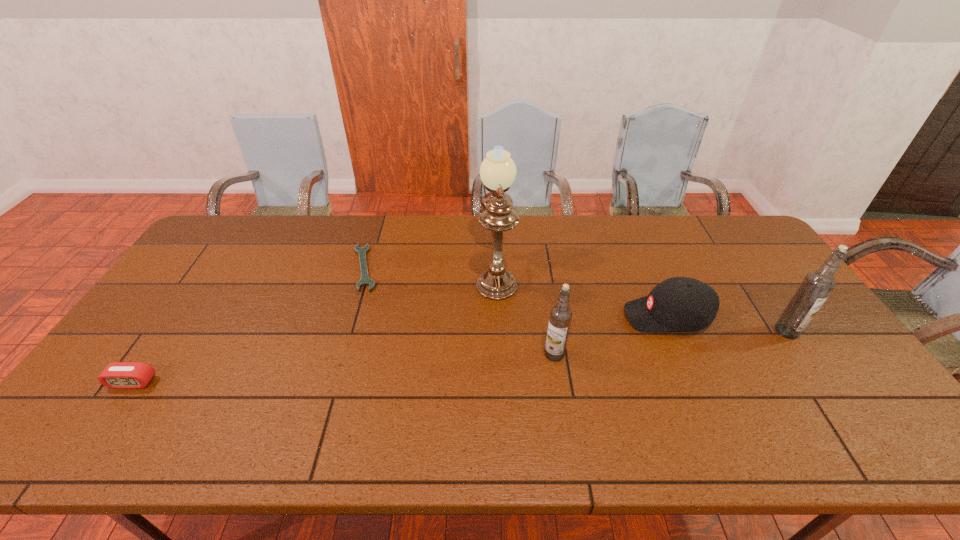
Where is `free region located on the back of the shortest object`? This screenshot has width=960, height=540. free region located on the back of the shortest object is located at coordinates (377, 225).

In order to click on free space located on the front-facing side of the leftmost object in this screenshot , I will do `click(115, 407)`.

Where is `oil lamp at the far edge`? oil lamp at the far edge is located at coordinates (497, 171).

I want to click on wrench that is at the far edge, so click(x=365, y=280).

Locate an element on the screen. Image resolution: width=960 pixels, height=540 pixels. object at the near edge is located at coordinates (118, 375).

You are a GUI agent. You are given a task and a screenshot of the screen. Output one action in this format:
    pyautogui.click(x=<x>, y=<y>)
    Task: Click on the object at the left edge
    The image size is (960, 540).
    Given the screenshot: What is the action you would take?
    pyautogui.click(x=118, y=375)

Locate an element on the screen. This screenshot has width=960, height=540. object positioned at the right edge is located at coordinates (816, 287).

You are a GUI agent. You are given a task and a screenshot of the screen. Output one action in this format:
    pyautogui.click(x=<x>, y=<y>)
    Task: Click on the object situated at the near left corner
    The width and height of the screenshot is (960, 540).
    Given the screenshot: What is the action you would take?
    pyautogui.click(x=118, y=375)

Find the location of a particular element. vacant space at the far edge is located at coordinates (540, 234).

Find the location of a particular element. The image size is (960, 540). free point at the near edge is located at coordinates click(x=684, y=408).